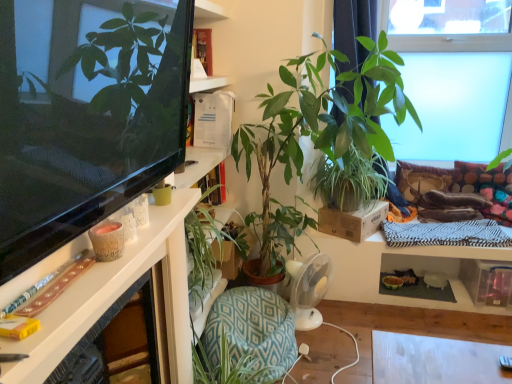
Question: Does transparent glass window at upper right turn towards green leafy plant at center, which ranks as the fourth houseplant in right-to-left order?

Choices:
 (A) yes
 (B) no

Answer: (B)

Question: Is transparent glass window at upper right not inside green leafy plant at center, which ranks as the fourth houseplant in right-to-left order?

Choices:
 (A) no
 (B) yes

Answer: (B)

Question: Is transparent glass window at upper right smaller than green leafy plant at center, which ranks as the fourth houseplant in right-to-left order?

Choices:
 (A) yes
 (B) no

Answer: (B)

Question: Is the position of transparent glass window at upper right more distant than that of green leafy plant at center, which ranks as the fourth houseplant in right-to-left order?

Choices:
 (A) yes
 (B) no

Answer: (A)

Question: Considering the relative sizes of transparent glass window at upper right and green leafy plant at center, acting as the 1th houseplant starting from the left, in the image provided, is transparent glass window at upper right wider than green leafy plant at center, acting as the 1th houseplant starting from the left,?

Choices:
 (A) no
 (B) yes

Answer: (A)

Question: Is green leafy plant at center, which appears as the 3th houseplant when viewed from the right, in front of or behind green leafy plant at center, which ranks as the fourth houseplant in right-to-left order, in the image?

Choices:
 (A) front
 (B) behind

Answer: (A)

Question: Is green leafy plant at center, acting as the 2th houseplant starting from the left, taller or shorter than green leafy plant at center, which ranks as the fourth houseplant in right-to-left order?

Choices:
 (A) short
 (B) tall

Answer: (B)

Question: Is green leafy plant at center, which appears as the 3th houseplant when viewed from the right, to the left or to the right of green leafy plant at center, acting as the 1th houseplant starting from the left, in the image?

Choices:
 (A) right
 (B) left

Answer: (A)

Question: Looking at the image, does green leafy plant at center, which appears as the 3th houseplant when viewed from the right, seem bigger or smaller compared to green leafy plant at center, which ranks as the fourth houseplant in right-to-left order?

Choices:
 (A) big
 (B) small

Answer: (A)

Question: Is green leafy plant at center, acting as the 2th houseplant starting from the left, in front of or behind multicolored fabric pillow at right, the first pillow positioned from the right, in the image?

Choices:
 (A) front
 (B) behind

Answer: (A)

Question: Looking at their shapes, would you say green leafy plant at center, which appears as the 3th houseplant when viewed from the right, is wider or thinner than multicolored fabric pillow at right, placed as the 2th pillow when sorted from left to right?

Choices:
 (A) wide
 (B) thin

Answer: (A)

Question: Is green leafy plant at center, acting as the 2th houseplant starting from the left, bigger or smaller than multicolored fabric pillow at right, placed as the 2th pillow when sorted from left to right?

Choices:
 (A) small
 (B) big

Answer: (B)

Question: Considering the positions of point (321, 84) and point (455, 187), is point (321, 84) closer or farther from the camera than point (455, 187)?

Choices:
 (A) closer
 (B) farther

Answer: (A)

Question: Considering the positions of white glossy desk at left and green leafy plant at center, acting as the 2th houseplant starting from the left, in the image, is white glossy desk at left taller or shorter than green leafy plant at center, acting as the 2th houseplant starting from the left,?

Choices:
 (A) short
 (B) tall

Answer: (A)

Question: Is white glossy desk at left bigger or smaller than green leafy plant at center, which appears as the 3th houseplant when viewed from the right?

Choices:
 (A) small
 (B) big

Answer: (A)